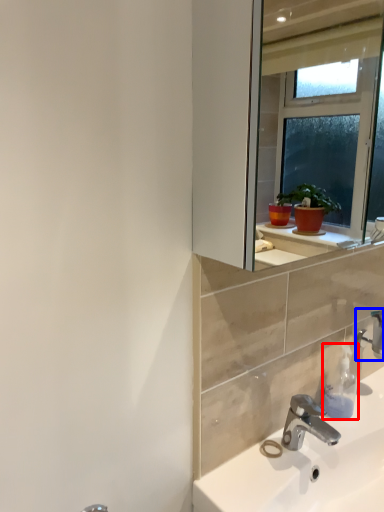
Question: Which object appears closest to the camera in this image, soap dispenser (highlighted by a red box) or tap (highlighted by a blue box)?

Choices:
 (A) soap dispenser
 (B) tap

Answer: (A)